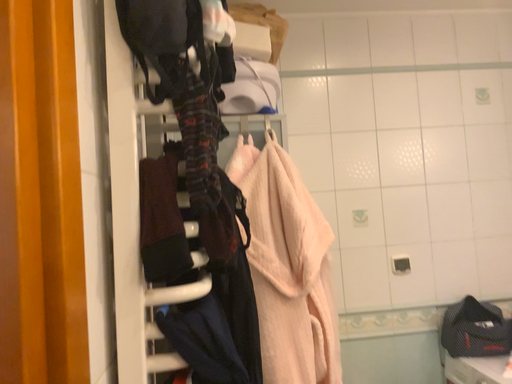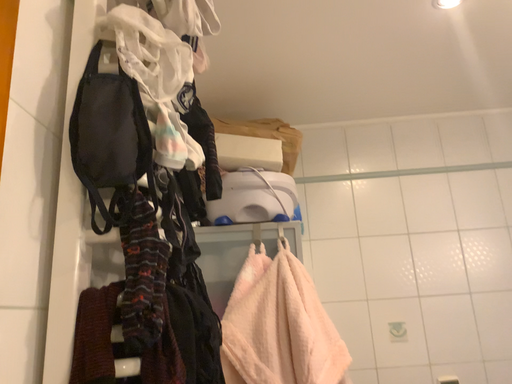
Question: Which way did the camera rotate in the video?

Choices:
 (A) rotated downward
 (B) rotated upward

Answer: (B)